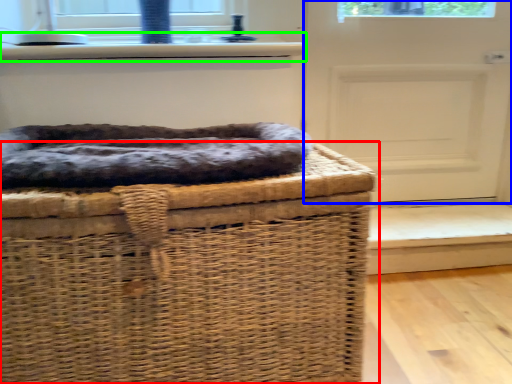
Question: Which is farther away from furniture (highlighted by a red box)? door (highlighted by a blue box) or window sill (highlighted by a green box)?

Choices:
 (A) door
 (B) window sill

Answer: (A)